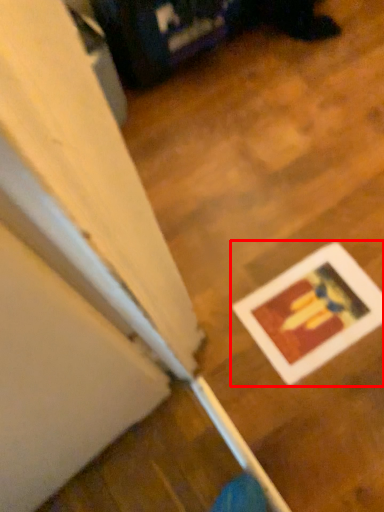
Question: From the image's perspective, what is the correct spatial positioning of picture frame (annotated by the red box) in reference to wood?

Choices:
 (A) above
 (B) below

Answer: (B)